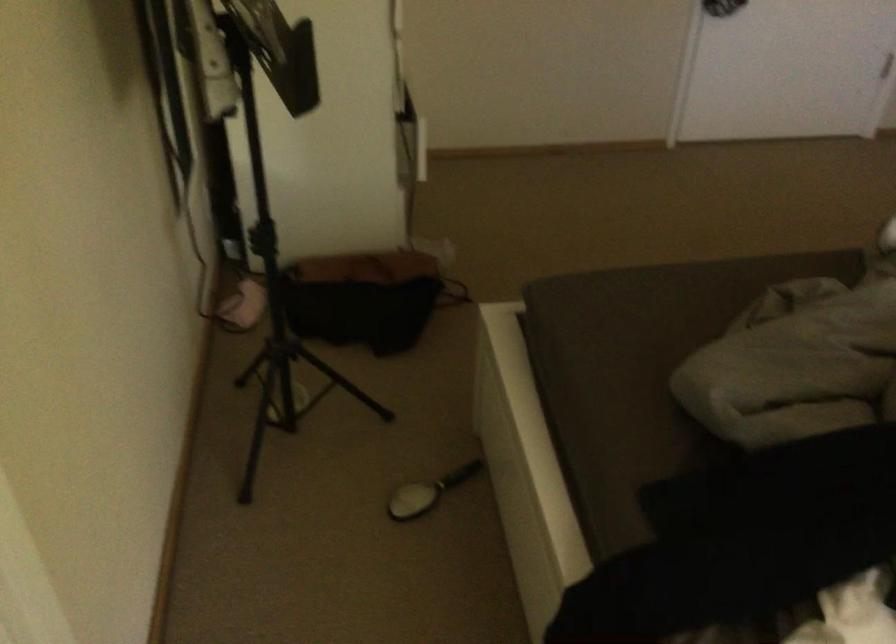
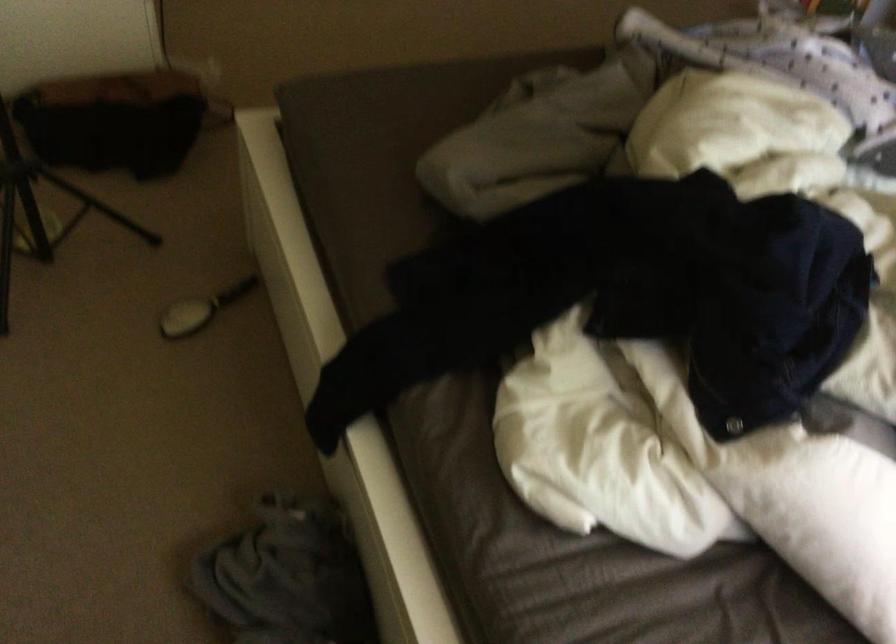
Which direction would the cameraman need to move to produce the second image?

The movement direction of the cameraman is right, backward.